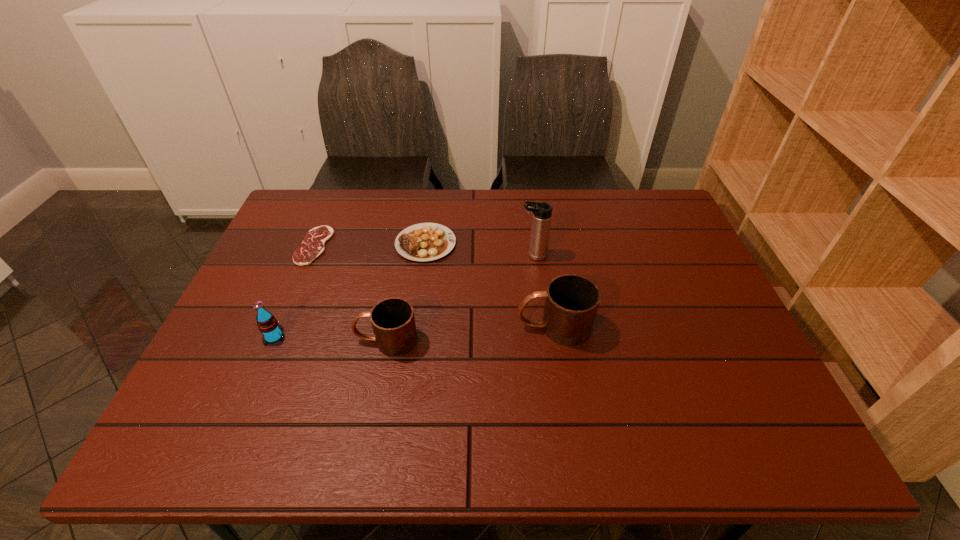
Where is `vacant space at the far right corner of the desktop`? vacant space at the far right corner of the desktop is located at coordinates (661, 204).

Image resolution: width=960 pixels, height=540 pixels. What are the coordinates of `vacant area that lies between the second shortest object and the left mug` in the screenshot? It's located at (406, 292).

What are the coordinates of `free space between the taller steak and the left mug` in the screenshot? It's located at (406, 292).

Image resolution: width=960 pixels, height=540 pixels. Identify the location of vacant space that's between the soda and the thermos bottle. (403, 296).

Find the location of `vacant space that's between the taller mug and the fourth tallest object`. vacant space that's between the taller mug and the fourth tallest object is located at coordinates (470, 334).

Where is `unoccupied position between the soda and the taller steak`? This screenshot has height=540, width=960. unoccupied position between the soda and the taller steak is located at coordinates (349, 290).

The width and height of the screenshot is (960, 540). What are the coordinates of `free space between the taller mug and the left steak` in the screenshot? It's located at (434, 286).

The height and width of the screenshot is (540, 960). I want to click on free spot between the right steak and the third shortest object, so click(x=406, y=292).

Find the location of a particular element. The image size is (960, 540). vacant area that lies between the soda and the second shortest object is located at coordinates (349, 290).

What are the coordinates of `vacant region between the taller steak and the thermos bottle` in the screenshot? It's located at (479, 249).